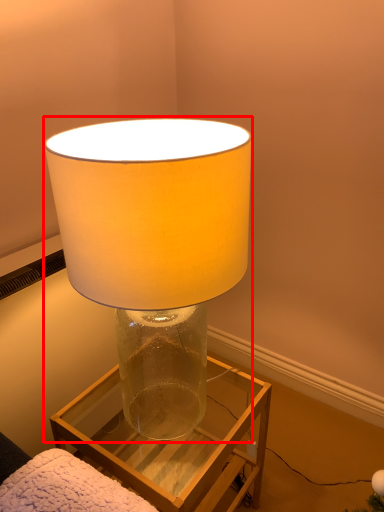
Question: From the image, what is the correct spatial relationship of lamp (annotated by the red box) in relation to furniture?

Choices:
 (A) left
 (B) right

Answer: (A)